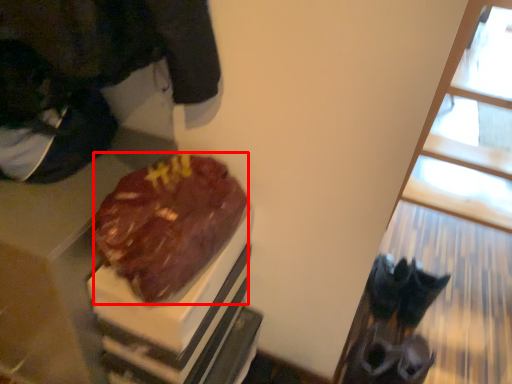
Question: Observing the image, what is the correct spatial positioning of chocolate cake (annotated by the red box) in reference to window?

Choices:
 (A) right
 (B) left

Answer: (B)